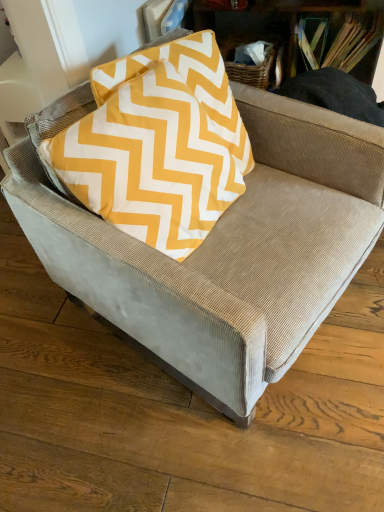
Question: Is point (49, 138) closer or farther from the camera than point (374, 37)?

Choices:
 (A) closer
 (B) farther

Answer: (A)

Question: From their relative heights in the image, would you say yellow fabric pillow at upper center is taller or shorter than wooden book at upper right?

Choices:
 (A) short
 (B) tall

Answer: (B)

Question: Visually, is yellow fabric pillow at upper center positioned to the left or to the right of wooden book at upper right?

Choices:
 (A) left
 (B) right

Answer: (A)

Question: In terms of size, does wooden book at upper right appear bigger or smaller than yellow fabric pillow at upper center?

Choices:
 (A) big
 (B) small

Answer: (B)

Question: Based on their positions, is wooden book at upper right located to the left or right of yellow fabric pillow at upper center?

Choices:
 (A) right
 (B) left

Answer: (A)

Question: From a real-world perspective, is wooden book at upper right above or below yellow fabric pillow at upper center?

Choices:
 (A) below
 (B) above

Answer: (A)

Question: From their relative heights in the image, would you say wooden book at upper right is taller or shorter than yellow fabric pillow at upper center?

Choices:
 (A) short
 (B) tall

Answer: (A)